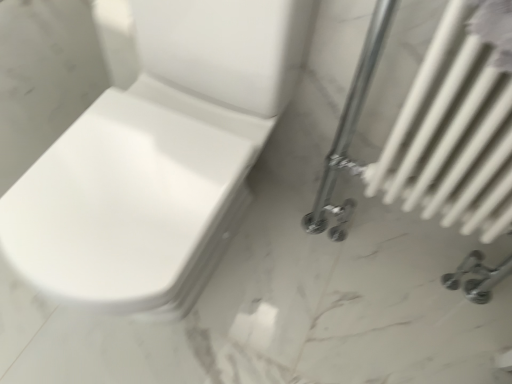
The width and height of the screenshot is (512, 384). What do you see at coordinates (159, 159) in the screenshot?
I see `white glossy toilet at center` at bounding box center [159, 159].

Identify the location of white glossy toilet at center. (159, 159).

Where is `white glossy toilet at center`? white glossy toilet at center is located at coordinates (159, 159).